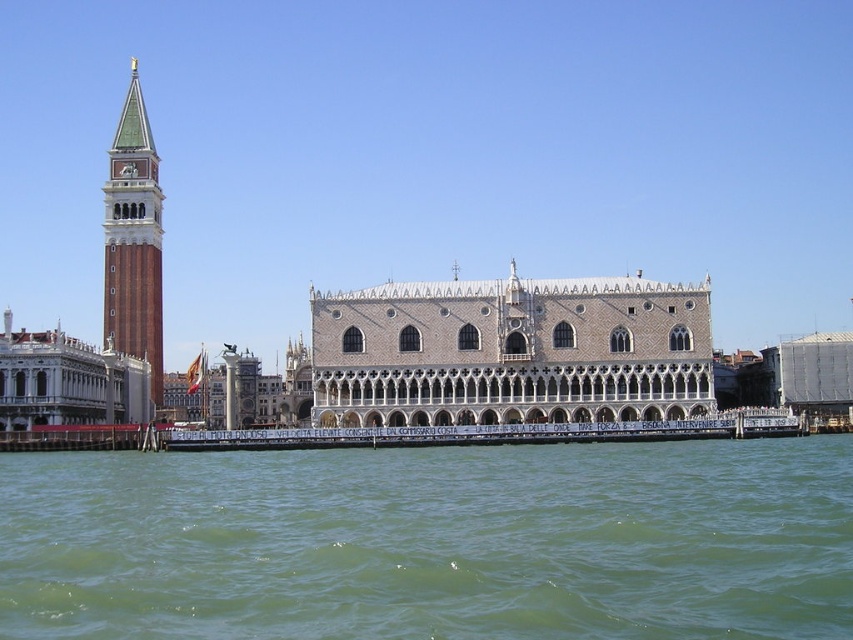
Question: Among these objects, which one is farthest from the camera?

Choices:
 (A) green water at lower center
 (B) green-tiled bell tower at left

Answer: (B)

Question: Is green water at lower center wider than white stone palace at center?

Choices:
 (A) no
 (B) yes

Answer: (B)

Question: Which of the following is the farthest from the observer?

Choices:
 (A) tap(491, 403)
 (B) tap(138, 100)
 (C) tap(798, 628)

Answer: (B)

Question: Can you confirm if white stone palace at center is positioned above green-tiled bell tower at left?

Choices:
 (A) no
 (B) yes

Answer: (A)

Question: Which point is farther to the camera?

Choices:
 (A) (158, 454)
 (B) (131, 276)

Answer: (B)

Question: Is green water at lower center positioned at the back of white stone palace at center?

Choices:
 (A) no
 (B) yes

Answer: (A)